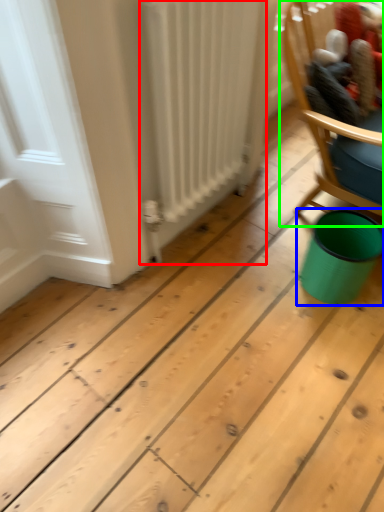
Question: Which object is positioned closest to radiator (highlighted by a red box)? Select from teal (highlighted by a blue box) and chair (highlighted by a green box).

Choices:
 (A) teal
 (B) chair

Answer: (B)